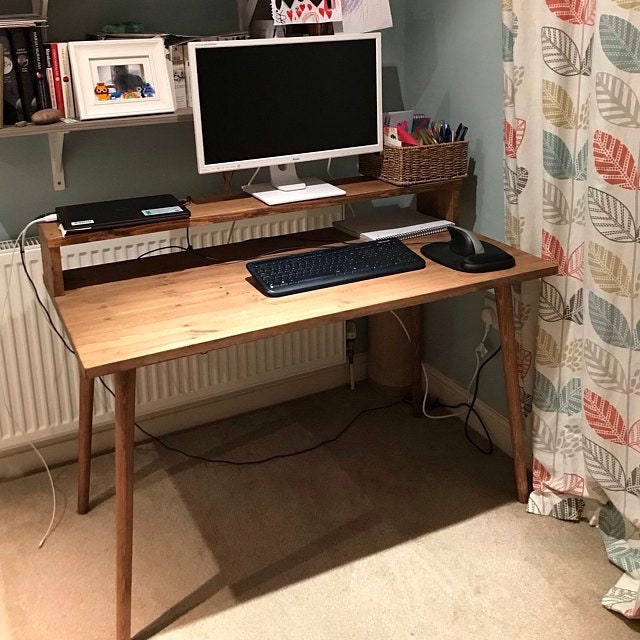
Where is `monitor`? The width and height of the screenshot is (640, 640). monitor is located at coordinates (235, 108).